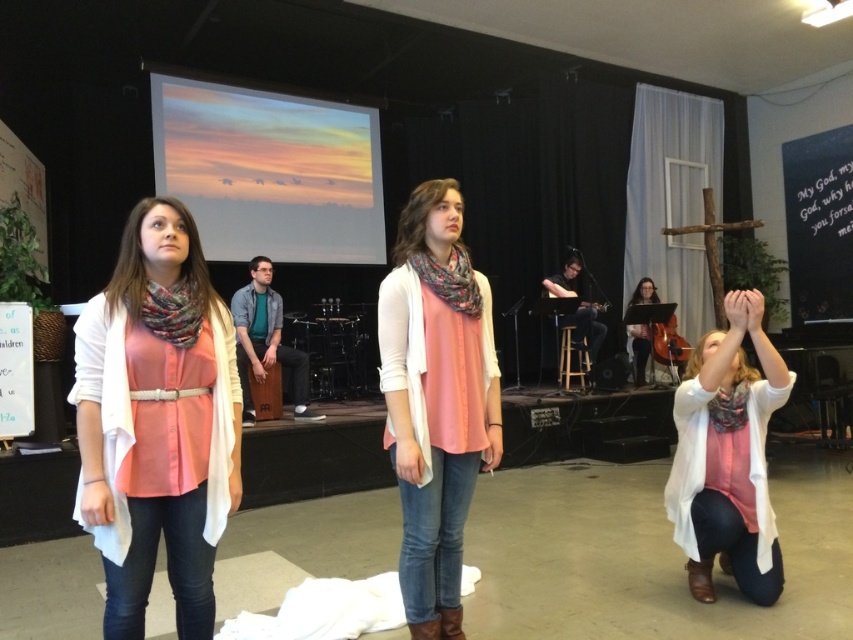
In the scene shown: You are an event photographer who needs to capture a clear shot of both the matte pink blouse at center and the matte pink scarf at lower right. Based on their positions, which one might be easier to focus on without adjusting your camera angle?

The matte pink blouse at center is in front of the matte pink scarf at lower right, so it would be easier to focus on the matte pink blouse at center without adjusting the camera angle since it is closer to the photographer.

You are a photographer setting up for a photo shoot in the described scene. You need to position a light source so it illuminates the printed silk scarf at left without casting a shadow on the matte black cello at center. Based on their positions, where should you place the light source?

The printed silk scarf at left is in front of the matte black cello at center, so placing the light source behind the scarf would cast its shadow forward, potentially blocking the cello. To avoid this, position the light source to the side or above the scarf, ensuring the light hits the scarf directly while avoiding casting a shadow towards the cello.